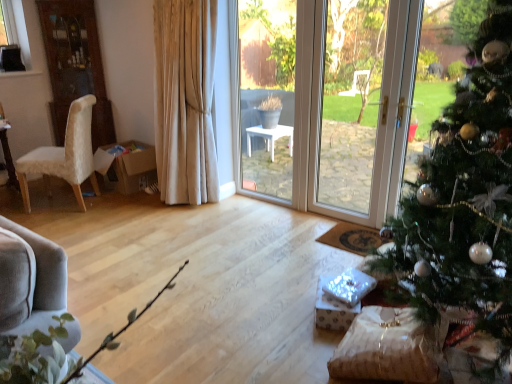
Question: Considering the positions of white plush chair at left and green matte christmas tree at right in the image, is white plush chair at left taller or shorter than green matte christmas tree at right?

Choices:
 (A) tall
 (B) short

Answer: (B)

Question: Choose the correct answer: Is white plush chair at left inside green matte christmas tree at right or outside it?

Choices:
 (A) inside
 (B) outside

Answer: (B)

Question: Looking at the image, does white plush chair at left seem bigger or smaller compared to green matte christmas tree at right?

Choices:
 (A) small
 (B) big

Answer: (A)

Question: In terms of height, does green matte christmas tree at right look taller or shorter compared to white plush chair at left?

Choices:
 (A) tall
 (B) short

Answer: (A)

Question: Considering the relative positions of green matte christmas tree at right and white plush chair at left in the image provided, is green matte christmas tree at right to the left or to the right of white plush chair at left?

Choices:
 (A) right
 (B) left

Answer: (A)

Question: From the image's perspective, is green matte christmas tree at right above or below white plush chair at left?

Choices:
 (A) above
 (B) below

Answer: (B)

Question: Is green matte christmas tree at right inside or outside of white plush chair at left?

Choices:
 (A) outside
 (B) inside

Answer: (A)